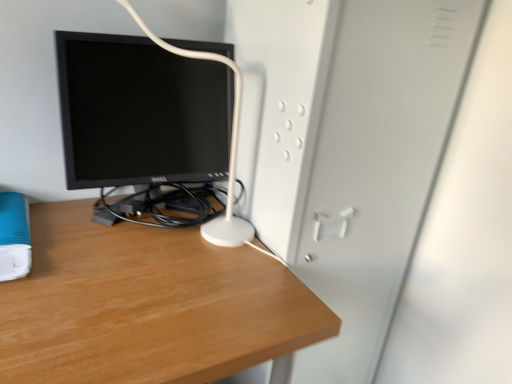
I want to click on black glossy monitor at center, so click(140, 112).

From the image's perspective, does wooden desk at center appear lower than white matte file cabinet at center?

Yes.

Is wooden desk at center oriented away from white matte file cabinet at center?

No, wooden desk at center is not facing the opposite direction of white matte file cabinet at center.

Is wooden desk at center thinner than white matte file cabinet at center?

Incorrect, the width of wooden desk at center is not less than that of white matte file cabinet at center.

Based on the photo, from the image's perspective, is blue matte paperback book at lower left above or below wooden desk at center?

blue matte paperback book at lower left is situated higher than wooden desk at center in the image.

Considering the positions of objects blue matte paperback book at lower left and wooden desk at center in the image provided, who is more to the left, blue matte paperback book at lower left or wooden desk at center?

blue matte paperback book at lower left.

Is blue matte paperback book at lower left taller or shorter than wooden desk at center?

Considering their sizes, blue matte paperback book at lower left has less height than wooden desk at center.

Which point is more forward, (252, 38) or (23, 243)?

The point (23, 243) is closer.

Considering the relative sizes of white matte file cabinet at center and blue matte paperback book at lower left in the image provided, is white matte file cabinet at center smaller than blue matte paperback book at lower left?

No.

What's the angular difference between white matte file cabinet at center and blue matte paperback book at lower left's facing directions?

0.358 degrees separate the facing orientations of white matte file cabinet at center and blue matte paperback book at lower left.

Which object is closer to the camera, white matte file cabinet at center or blue matte paperback book at lower left?

blue matte paperback book at lower left is closer to the camera.

Considering the relative positions of white matte file cabinet at center and wooden desk at center in the image provided, is white matte file cabinet at center to the left of wooden desk at center from the viewer's perspective?

In fact, white matte file cabinet at center is to the right of wooden desk at center.

From the image's perspective, which one is positioned higher, white matte file cabinet at center or wooden desk at center?

white matte file cabinet at center appears higher in the image.

Is the position of white matte file cabinet at center more distant than that of wooden desk at center?

Yes, white matte file cabinet at center is further from the camera.

Is white matte file cabinet at center oriented away from wooden desk at center?

white matte file cabinet at center is not turned away from wooden desk at center.

You are a GUI agent. You are given a task and a screenshot of the screen. Output one action in this format:
    pyautogui.click(x=<x>, y=<y>)
    Task: Click on the desk on the left of black glossy monitor at center
    The height and width of the screenshot is (384, 512).
    Given the screenshot: What is the action you would take?
    pyautogui.click(x=147, y=305)

From a real-world perspective, relative to black glossy monitor at center, is wooden desk at center vertically above or below?

Clearly, from a real-world perspective, wooden desk at center is below black glossy monitor at center.

Can you confirm if wooden desk at center is positioned to the right of black glossy monitor at center?

No.

Is wooden desk at center positioned before black glossy monitor at center?

Yes, wooden desk at center is closer to the viewer.

Are white matte file cabinet at center and black glossy monitor at center making contact?

No, white matte file cabinet at center is not making contact with black glossy monitor at center.

Is white matte file cabinet at center positioned with its back to black glossy monitor at center?

white matte file cabinet at center is not turned away from black glossy monitor at center.

Which object is further away from the camera taking this photo, white matte file cabinet at center or black glossy monitor at center?

Positioned behind is black glossy monitor at center.

Looking at their sizes, would you say black glossy monitor at center is wider or thinner than white matte file cabinet at center?

black glossy monitor at center is thinner than white matte file cabinet at center.

Does black glossy monitor at center come in front of white matte file cabinet at center?

No, the depth of black glossy monitor at center is greater than that of white matte file cabinet at center.

The height and width of the screenshot is (384, 512). In order to click on computer monitor above the white matte file cabinet at center (from the image's perspective) in this screenshot , I will do `click(140, 112)`.

Identify the location of desk on the left side of white matte file cabinet at center. The image size is (512, 384). (147, 305).

Find the location of a particular element. The image size is (512, 384). paperback book behind the wooden desk at center is located at coordinates (14, 236).

Estimate the real-world distances between objects in this image. Which object is further from wooden desk at center, white matte file cabinet at center or blue matte paperback book at lower left?

Based on the image, white matte file cabinet at center appears to be further to wooden desk at center.

Considering their positions, is white matte file cabinet at center positioned closer to black glossy monitor at center than wooden desk at center?

The object closer to black glossy monitor at center is wooden desk at center.

Looking at the image, which one is located closer to black glossy monitor at center, blue matte paperback book at lower left or white matte file cabinet at center?

white matte file cabinet at center lies closer to black glossy monitor at center than the other object.

Looking at the image, which one is located closer to blue matte paperback book at lower left, black glossy monitor at center or wooden desk at center?

wooden desk at center.

Looking at the image, which one is located closer to blue matte paperback book at lower left, white matte file cabinet at center or wooden desk at center?

wooden desk at center lies closer to blue matte paperback book at lower left than the other object.

When comparing their distances from blue matte paperback book at lower left, does black glossy monitor at center or white matte file cabinet at center seem further?

The object further to blue matte paperback book at lower left is white matte file cabinet at center.

Considering their positions, is white matte file cabinet at center positioned further to black glossy monitor at center than blue matte paperback book at lower left?

The object further to black glossy monitor at center is blue matte paperback book at lower left.

Considering their positions, is wooden desk at center positioned further to black glossy monitor at center than blue matte paperback book at lower left?

blue matte paperback book at lower left is positioned further to the anchor black glossy monitor at center.

I want to click on file cabinet that lies between black glossy monitor at center and wooden desk at center from top to bottom, so click(x=347, y=148).

The width and height of the screenshot is (512, 384). What are the coordinates of `desk between blue matte paperback book at lower left and white matte file cabinet at center in the horizontal direction` in the screenshot? It's located at (147, 305).

You are a GUI agent. You are given a task and a screenshot of the screen. Output one action in this format:
    pyautogui.click(x=<x>, y=<y>)
    Task: Click on the computer monitor situated between blue matte paperback book at lower left and white matte file cabinet at center from left to right
    This screenshot has width=512, height=384.
    Given the screenshot: What is the action you would take?
    pyautogui.click(x=140, y=112)

Where is `paperback book between black glossy monitor at center and wooden desk at center from top to bottom`? paperback book between black glossy monitor at center and wooden desk at center from top to bottom is located at coordinates (14, 236).